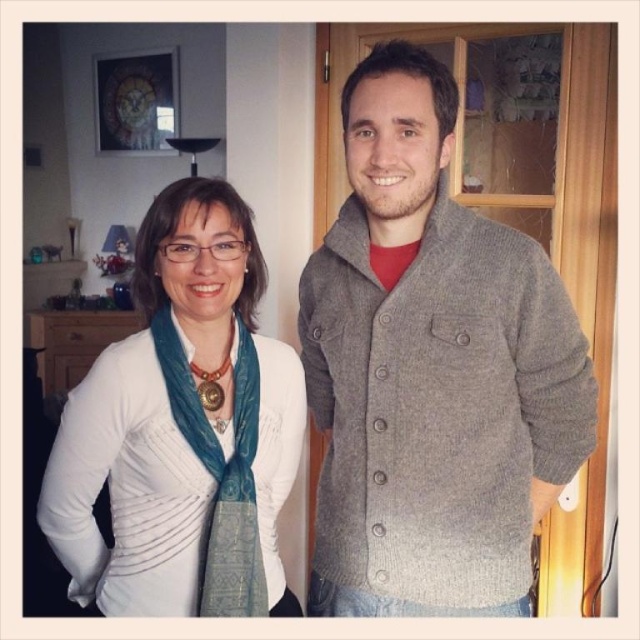
Question: Which point is farther from the camera taking this photo?

Choices:
 (A) (392, 614)
 (B) (262, 480)

Answer: (B)

Question: Which object is farther from the camera taking this photo?

Choices:
 (A) white matte scarf at left
 (B) gray woolen sweater at center

Answer: (A)

Question: Can you confirm if gray woolen sweater at center is positioned below white matte scarf at left?

Choices:
 (A) yes
 (B) no

Answer: (B)

Question: Is gray woolen sweater at center to the left of white matte scarf at left from the viewer's perspective?

Choices:
 (A) no
 (B) yes

Answer: (A)

Question: Which point is farther from the camera taking this photo?

Choices:
 (A) (499, 500)
 (B) (173, 600)

Answer: (B)

Question: Does gray woolen sweater at center appear on the left side of white matte scarf at left?

Choices:
 (A) no
 (B) yes

Answer: (A)